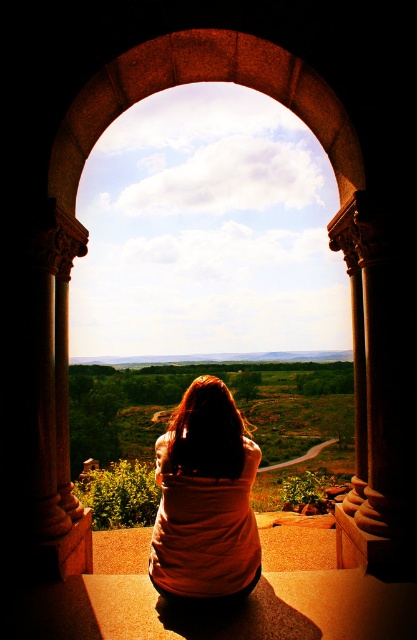
You are an interior designer assessing the space through the large arched stone window. You notice the matte orange shirt at center and the stone archway at center. Based on their relative sizes, which object would you say is narrower?

The matte orange shirt at center is thinner than the stone archway at center, so the matte orange shirt at center is narrower.

You are standing in the room and want to touch both the matte orange shirt at center and the stone archway at center. Which object should you reach for first?

You should reach for the matte orange shirt at center first because it is closer to you than the stone archway at center.